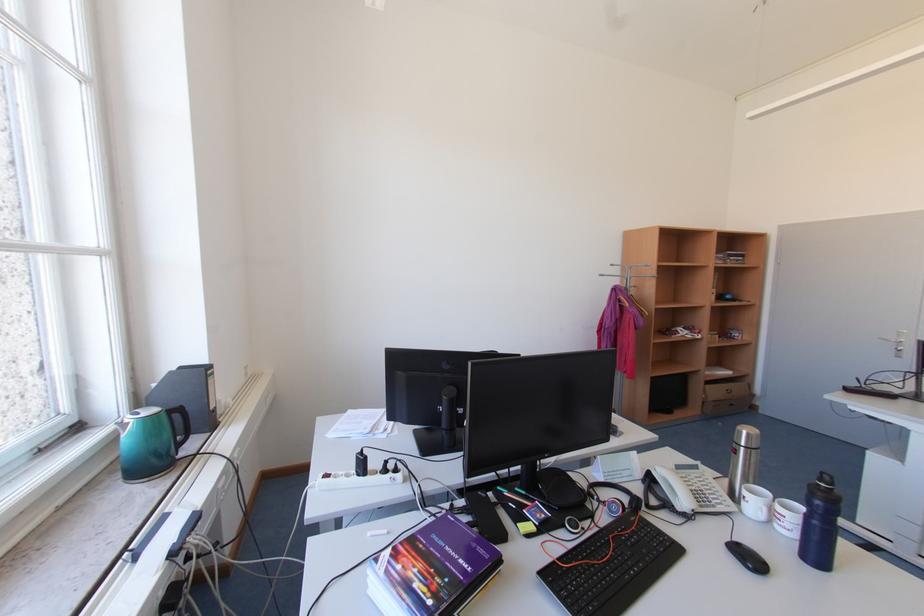
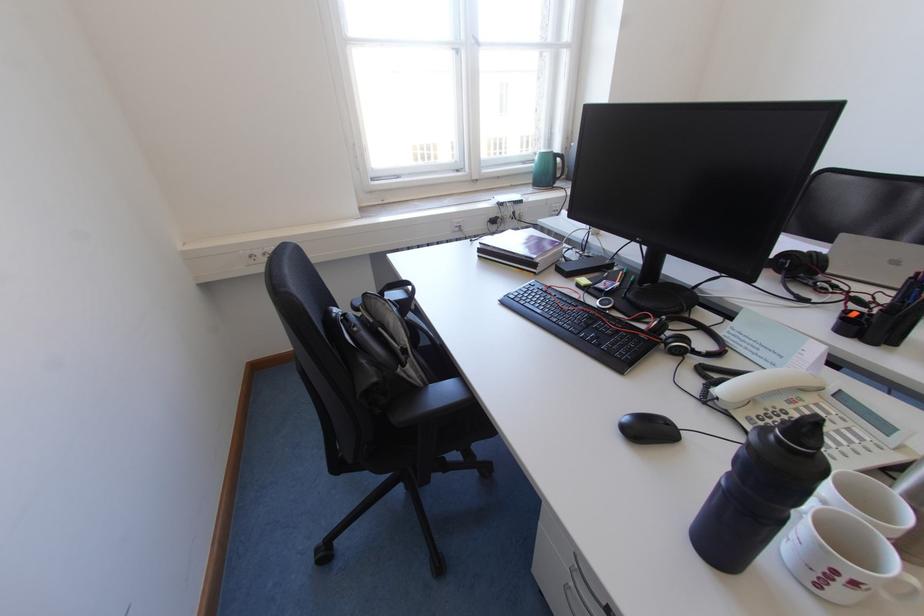
In the second image, find the point that corresponds to point (185, 416) in the first image.

(566, 161)